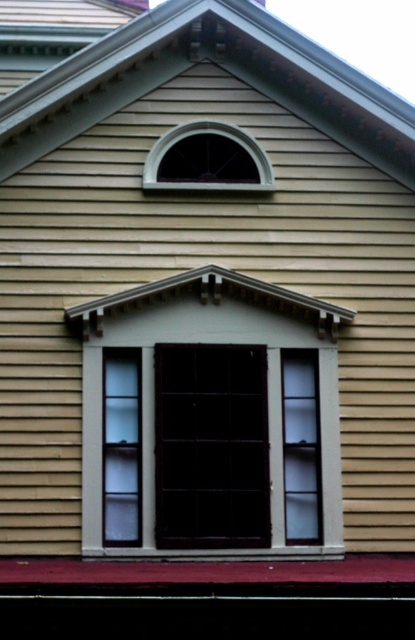
Question: Which point is closer to the camera?

Choices:
 (A) (175, 477)
 (B) (231, 180)

Answer: (A)

Question: Which object is farther from the camera taking this photo?

Choices:
 (A) matte gray window at center
 (B) matte gray window at upper center

Answer: (B)

Question: Is matte gray window at center smaller than matte gray window at upper center?

Choices:
 (A) no
 (B) yes

Answer: (A)

Question: Which of the following is the closest to the observer?

Choices:
 (A) matte gray window at upper center
 (B) matte gray window at center

Answer: (B)

Question: Is the position of matte gray window at center more distant than that of matte gray window at upper center?

Choices:
 (A) yes
 (B) no

Answer: (B)

Question: Is matte gray window at center thinner than matte gray window at upper center?

Choices:
 (A) yes
 (B) no

Answer: (B)